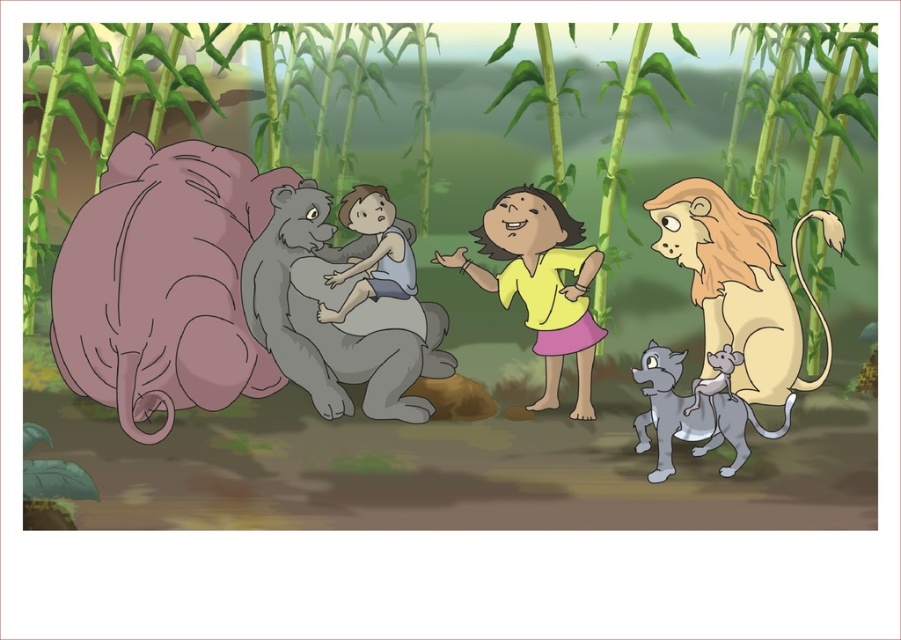
You are a tailor measuring clothes for the yellow matte shirt at center and the gray furry cat at lower right. Which one requires a wider fabric piece for their respective garments?

The yellow matte shirt at center requires a wider fabric piece because its width surpasses that of the gray furry cat at lower right.

You are standing in the jungle scene and want to place a small flower pot between the two points, point (779, 356) and point (385, 268). Which point should the flower pot be closer to in order to be nearer to the foreground?

The flower pot should be closer to point (779, 356) because it is closer to the viewer than point (385, 268).

You are an animal in the jungle scene and want to find the yellow matte shirt at center and the gray furry cat at lower right. Which one is closer to the left side of the image?

The yellow matte shirt at center is to the left of the gray furry cat at lower right, so it is closer to the left side of the image.